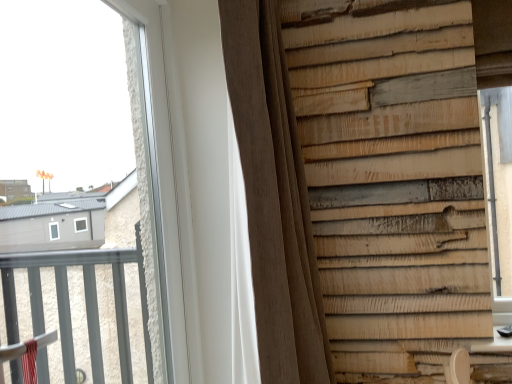
Question: Does brown textured curtain at center appear on the right side of transparent glass window at upper left?

Choices:
 (A) yes
 (B) no

Answer: (A)

Question: Does brown textured curtain at center have a greater height compared to transparent glass window at upper left?

Choices:
 (A) no
 (B) yes

Answer: (B)

Question: Is transparent glass window at upper left located within brown textured curtain at center?

Choices:
 (A) no
 (B) yes

Answer: (A)

Question: From the image's perspective, does brown textured curtain at center appear lower than transparent glass window at upper left?

Choices:
 (A) yes
 (B) no

Answer: (A)

Question: Would you consider brown textured curtain at center to be distant from transparent glass window at upper left?

Choices:
 (A) yes
 (B) no

Answer: (B)

Question: Can we say brown textured curtain at center lies outside transparent glass window at upper left?

Choices:
 (A) yes
 (B) no

Answer: (A)

Question: Can you confirm if transparent glass window at upper left is positioned to the left of brown textured curtain at center?

Choices:
 (A) yes
 (B) no

Answer: (A)

Question: From a real-world perspective, is transparent glass window at upper left located higher than brown textured curtain at center?

Choices:
 (A) yes
 (B) no

Answer: (A)

Question: Does transparent glass window at upper left have a larger size compared to brown textured curtain at center?

Choices:
 (A) no
 (B) yes

Answer: (A)

Question: From the image's perspective, is transparent glass window at upper left under brown textured curtain at center?

Choices:
 (A) yes
 (B) no

Answer: (B)

Question: Can you confirm if transparent glass window at upper left is shorter than brown textured curtain at center?

Choices:
 (A) yes
 (B) no

Answer: (A)

Question: From a real-world perspective, is transparent glass window at upper left under brown textured curtain at center?

Choices:
 (A) no
 (B) yes

Answer: (A)

Question: Is point (267, 339) positioned closer to the camera than point (156, 157)?

Choices:
 (A) farther
 (B) closer

Answer: (B)